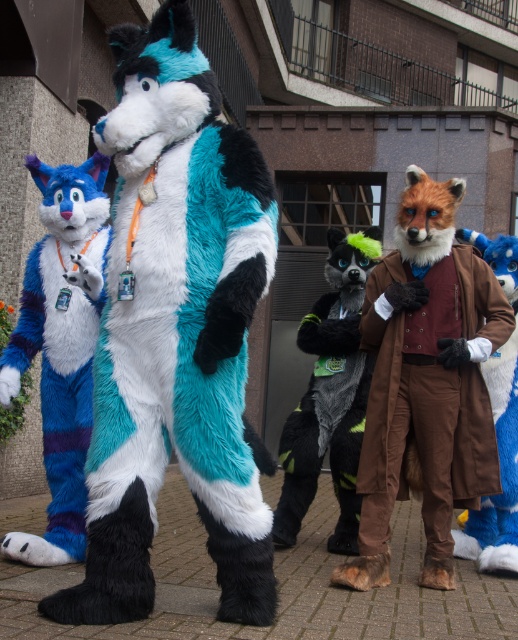
Question: Which point appears farthest from the camera in this image?

Choices:
 (A) (322, 397)
 (B) (95, 212)

Answer: (A)

Question: Is teal fur coat at center positioned behind black fur coat at center?

Choices:
 (A) yes
 (B) no

Answer: (B)

Question: Where is teal fur coat at center located in relation to brown textured coat at center in the image?

Choices:
 (A) left
 (B) right

Answer: (A)

Question: Which of the following is the farthest from the observer?

Choices:
 (A) (75, 394)
 (B) (328, 276)

Answer: (B)

Question: Estimate the real-world distances between objects in this image. Which object is closer to the black fur coat at center?

Choices:
 (A) brown fuzzy coat at right
 (B) fluffy blue and white fur at left
 (C) teal fur coat at center
 (D) brown textured coat at center

Answer: (D)

Question: Can you confirm if teal fur coat at center is positioned above black fur coat at center?

Choices:
 (A) yes
 (B) no

Answer: (A)